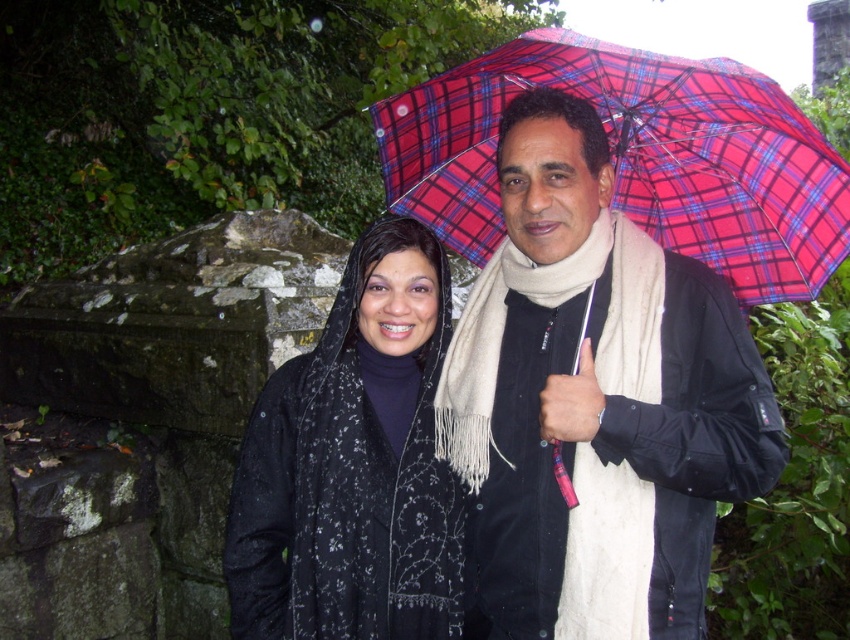
You are a photographer trying to capture a closeup of the matte black jacket at center. The camera you are using has a limited focus range of 0.5 meters. Given that the point where the matte black jacket at center is located is at coordinate point (596, 401), can you determine if the jacket will be within the focus range of the camera?

The matte black jacket at center is located at point (596, 401). Since the camera has a focus range of 0.5 meters, the jacket will be within the focus range if the distance from the camera to the jacket is less than or equal to 0.5 meters. However, the coordinates provided do not indicate the actual distance from the camera, so it is impossible to determine without additional information about the camera position or the scale of the coordinate system.

You are a photographer trying to capture the plaid fabric umbrella at upper center and the black textured scarf at center in a single frame. Given that the umbrella is larger, how should you position your camera to ensure both objects are fully visible?

Since the plaid fabric umbrella at upper center is larger than the black textured scarf at center, you should position your camera closer to the black textured scarf at center to balance their sizes in the frame.